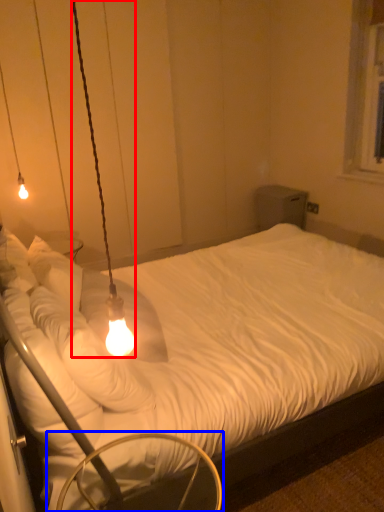
Question: Which of the following is the closest to the observer, lamp (highlighted by a red box) or swivel chair (highlighted by a blue box)?

Choices:
 (A) lamp
 (B) swivel chair

Answer: (A)